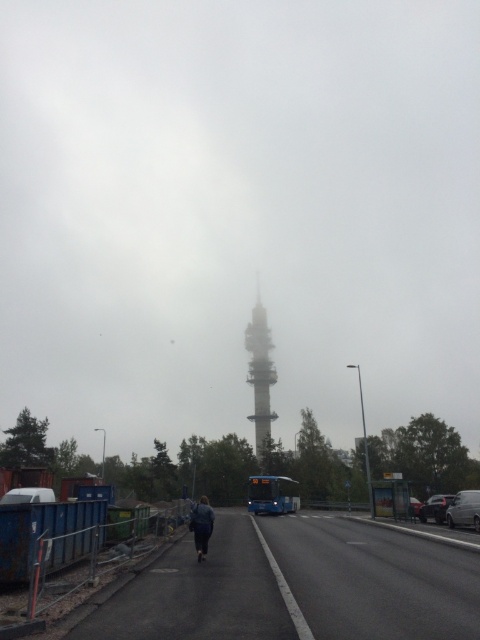
Question: Does white smooth tower at center have a larger size compared to silver metallic van at center?

Choices:
 (A) yes
 (B) no

Answer: (A)

Question: Does asphalt road at lower center come behind blue metallic bus at center?

Choices:
 (A) yes
 (B) no

Answer: (B)

Question: Considering the real-world distances, which object is farthest from the dark blue jacket at center?

Choices:
 (A) white smooth tower at center
 (B) asphalt road at lower center

Answer: (A)

Question: Considering the relative positions of foggy tower at center and silver metallic van at center in the image provided, where is foggy tower at center located with respect to silver metallic van at center?

Choices:
 (A) right
 (B) left

Answer: (B)

Question: Which object is positioned farthest from the metallic silver sedan at right?

Choices:
 (A) dark blue jacket at center
 (B) asphalt road at lower center
 (C) blue metallic bus at center
 (D) metallic silver car at lower left

Answer: (D)

Question: Which point appears closest to the camera in this image?

Choices:
 (A) (54, 499)
 (B) (442, 520)

Answer: (A)